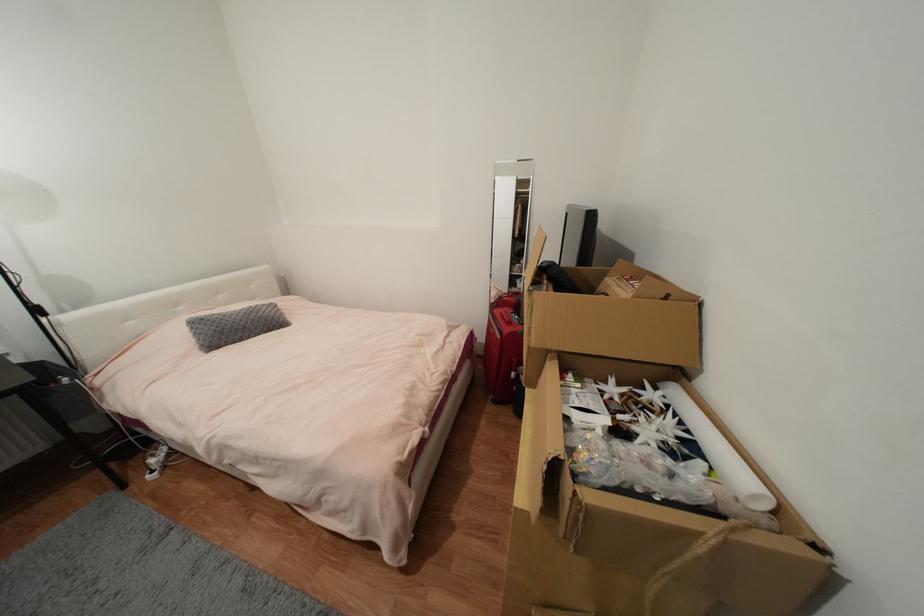
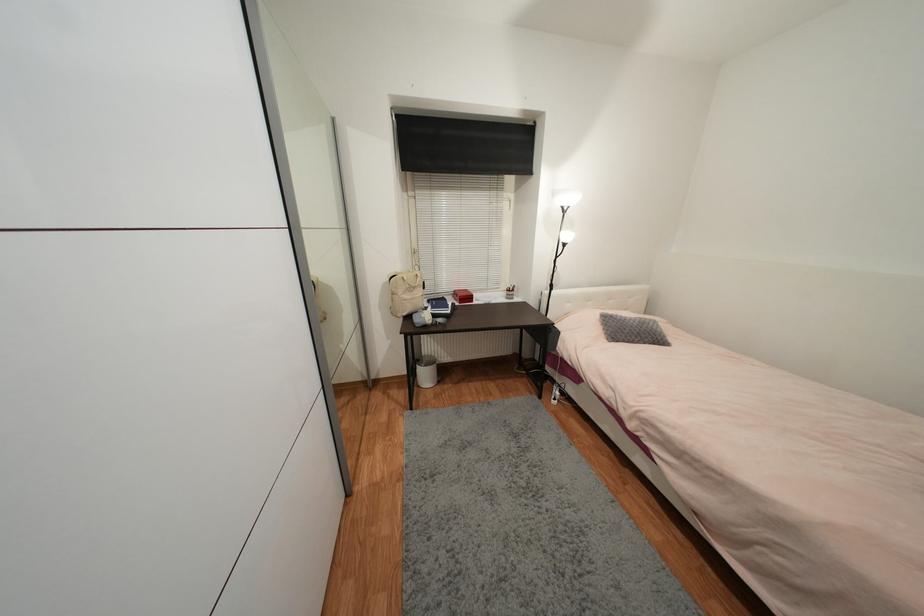
Locate, in the second image, the point that corresponds to point (244, 320) in the first image.

(639, 326)